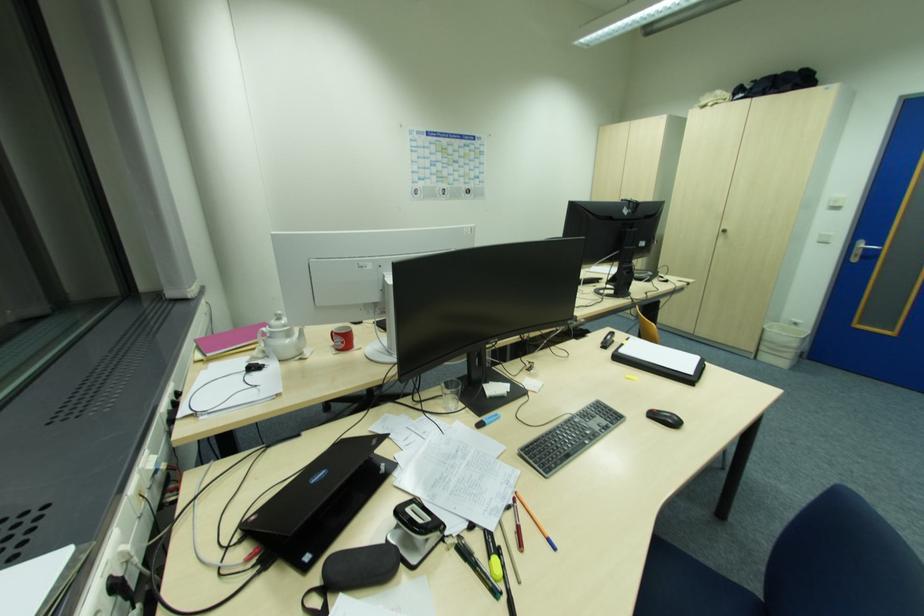
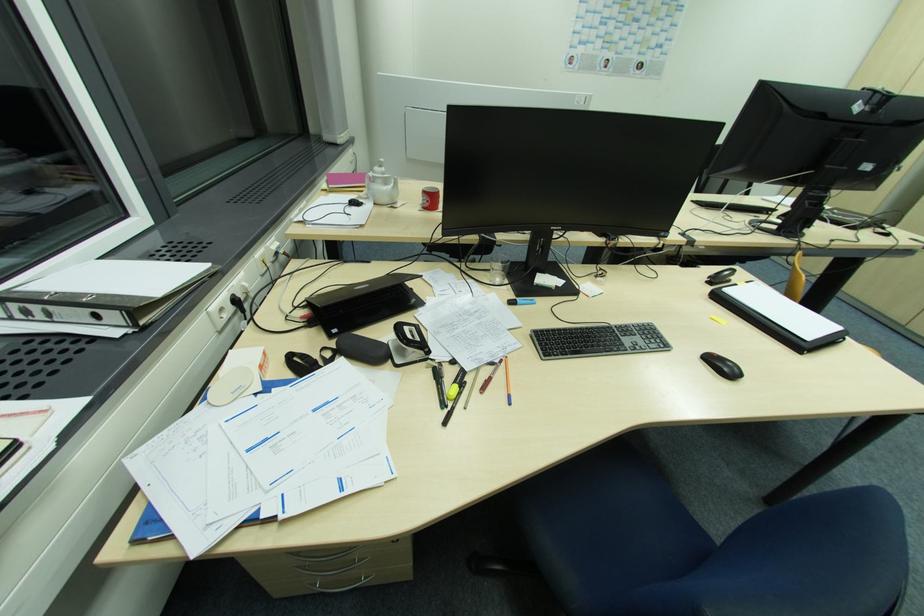
Where in the second image is the point corresponding to the point at 672,422 from the first image?

(728, 371)